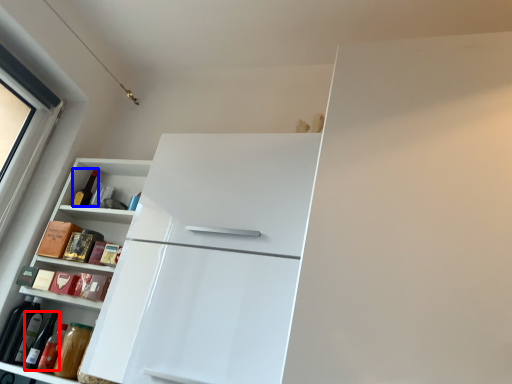
Question: Which object is closer to the camera taking this photo, wine bottle (highlighted by a red box) or bottle (highlighted by a blue box)?

Choices:
 (A) wine bottle
 (B) bottle

Answer: (A)